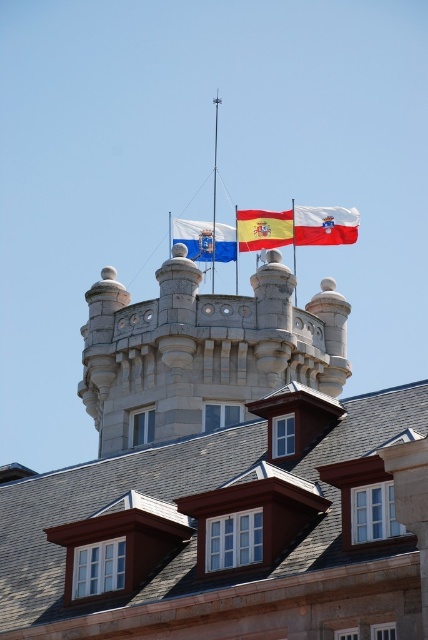
You are an architect designing a scale model of this building. You have two flags, the red fabric flag at center and the blue fabric flag at center. Which flag should you make larger in your model to accurately represent the building shown?

You should make the red fabric flag at center larger than the blue fabric flag at center in your model because the red fabric flag at center is bigger than blue fabric flag at center in the original building.

You are an architect examining the building from the ground. You notice the red fabric flag at upper center and the metallic flagpole at upper center. Which object is closer to the right edge of the building?

The red fabric flag at upper center is positioned on the right side of the metallic flagpole at upper center, so it is closer to the right edge of the building.